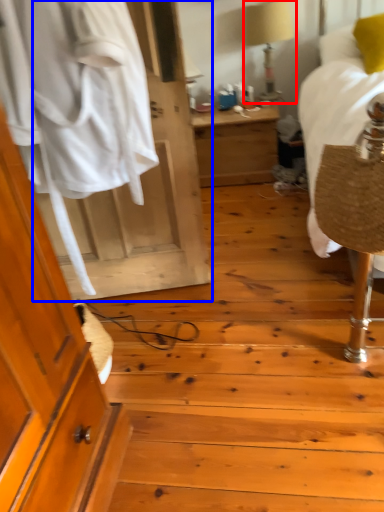
Question: Which point is further to the camera, table lamp (highlighted by a red box) or door (highlighted by a blue box)?

Choices:
 (A) table lamp
 (B) door

Answer: (A)